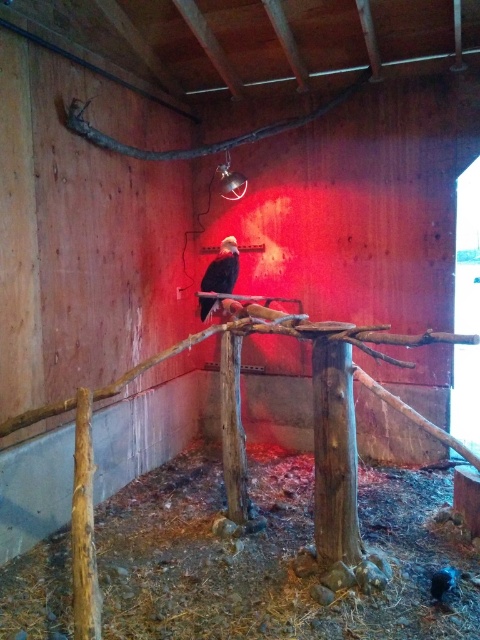
Between brown rough branch at upper center and black feathered bird at center, which one appears on the left side from the viewer's perspective?

From the viewer's perspective, black feathered bird at center appears more on the left side.

How far apart are brown rough branch at upper center and black feathered bird at center?

brown rough branch at upper center is 3.44 feet away from black feathered bird at center.

Is point (119, 148) farther from camera compared to point (224, 291)?

No, it is not.

The width and height of the screenshot is (480, 640). Identify the location of brown rough branch at upper center. (203, 145).